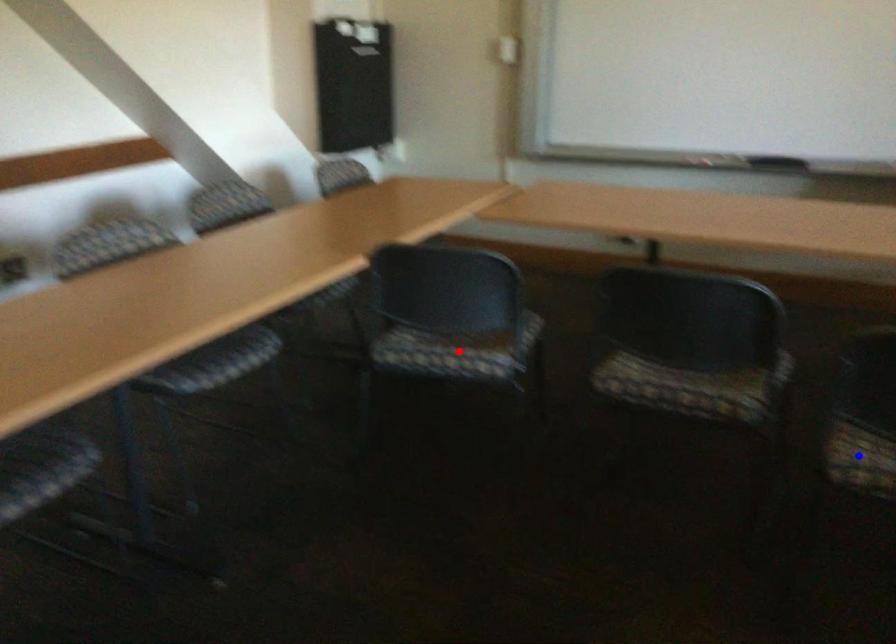
Question: Which of the two points in the image is closer to the camera?

Choices:
 (A) Blue point is closer.
 (B) Red point is closer.

Answer: (A)